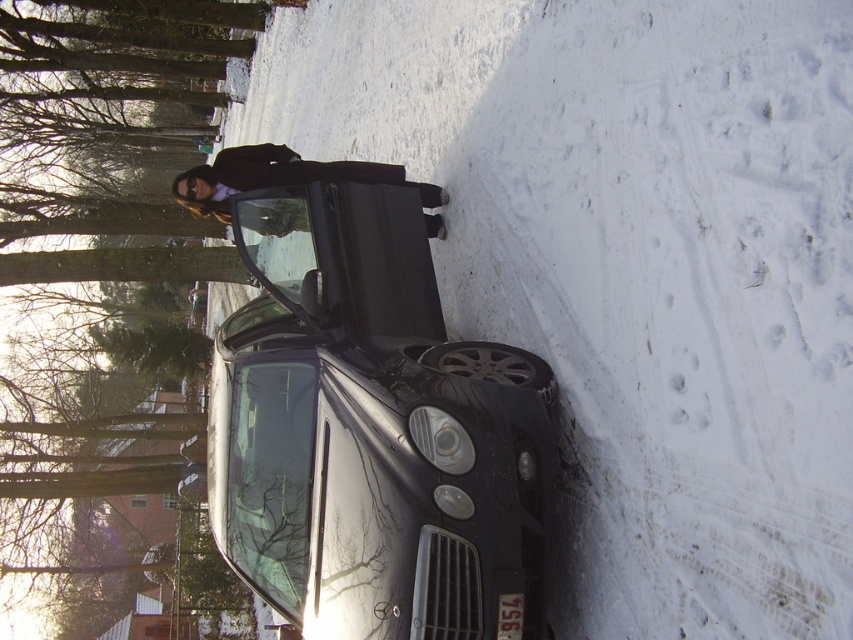
You are a delivery person trying to load a large package into the trunk of the glossy black car at center. The package is as wide as the black fabric coat at center. Will the package fit in the trunk?

The glossy black car at center is wider than the black fabric coat at center, so the package, which is as wide as the black fabric coat at center, will fit in the trunk.

You are a delivery person trying to reach the driver of the glossy black car at center. The driver is wearing the black fabric coat at center. To approach them, you need to walk around either the left or right side of the car. Based on their current positions, which side of the car should you walk around to get to the driver?

The glossy black car at center is positioned on the right side of black fabric coat at center, so the driver is likely standing to the left of the car. Therefore, you should walk around the left side of the glossy black car at center to approach the driver wearing the black fabric coat at center.

You are a delivery person trying to reach the car parked at the center of the snowy area. You see the white powdery snow at center and the black fabric coat at center. Which object is closer to you as you approach the car?

The white powdery snow at center is closer to the viewer than the black fabric coat at center, so the snow will be the first thing you encounter as you approach the car.